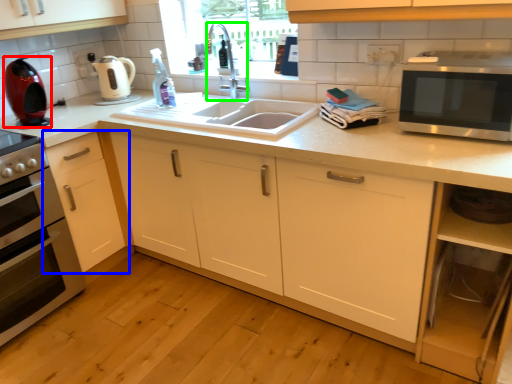
Question: Estimate the real-world distances between objects in this image. Which object is closer to coffee machine (highlighted by a red box), cabinetry (highlighted by a blue box) or faucet (highlighted by a green box)?

Choices:
 (A) cabinetry
 (B) faucet

Answer: (A)